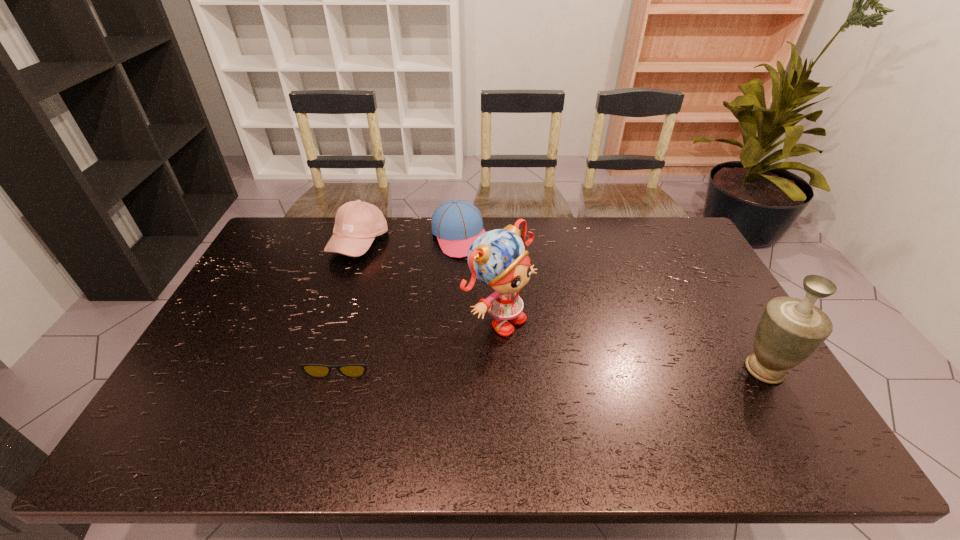
The height and width of the screenshot is (540, 960). I want to click on sunglasses, so click(x=313, y=370).

The height and width of the screenshot is (540, 960). Identify the location of urn. (790, 330).

Find the location of a particular element. doll is located at coordinates (497, 258).

At what (x,y) coordinates should I click in order to perform the action: click on the right baseball cap. Please return your answer as a coordinate pair (x, y). Looking at the image, I should click on (457, 223).

The image size is (960, 540). What are the coordinates of `the shorter baseball cap` in the screenshot? It's located at (457, 223).

This screenshot has width=960, height=540. In order to click on the left baseball cap in this screenshot , I will do `click(357, 223)`.

At what (x,y) coordinates should I click in order to perform the action: click on vacant space located 0.070m on the front-facing side of the sunglasses. Please return your answer as a coordinate pair (x, y). The image size is (960, 540). Looking at the image, I should click on (330, 402).

Image resolution: width=960 pixels, height=540 pixels. What are the coordinates of `vacant space located 0.170m on the back of the rightmost object` in the screenshot? It's located at (727, 306).

I want to click on vacant region located 0.140m on the face of the doll, so click(x=573, y=366).

This screenshot has height=540, width=960. In order to click on vacant space situated on the face of the doll in this screenshot , I will do `click(633, 403)`.